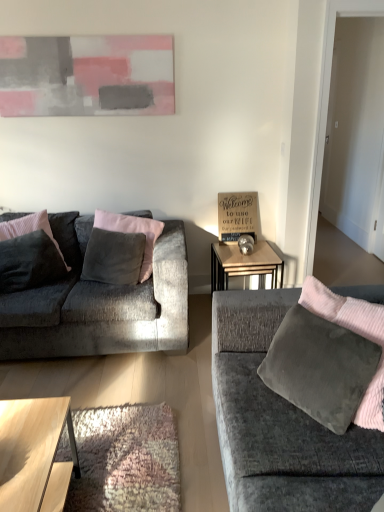
Question: Would you say abstract painting at upper center contains velvet dark gray pillow at left, the 1th pillow in the left-to-right sequence?

Choices:
 (A) no
 (B) yes

Answer: (A)

Question: From a real-world perspective, is abstract painting at upper center positioned over velvet dark gray pillow at left, the 1th pillow in the left-to-right sequence, based on gravity?

Choices:
 (A) yes
 (B) no

Answer: (A)

Question: Is abstract painting at upper center thinner than velvet dark gray pillow at left, the 1th pillow in the left-to-right sequence?

Choices:
 (A) no
 (B) yes

Answer: (B)

Question: From the image's perspective, is abstract painting at upper center beneath velvet dark gray pillow at left, which is counted as the second pillow, starting from the right?

Choices:
 (A) yes
 (B) no

Answer: (B)

Question: From the image's perspective, is abstract painting at upper center on velvet dark gray pillow at left, the 1th pillow in the left-to-right sequence?

Choices:
 (A) no
 (B) yes

Answer: (B)

Question: Considering the relative positions of abstract painting at upper center and velvet dark gray pillow at left, the 1th pillow in the left-to-right sequence, in the image provided, is abstract painting at upper center in front of velvet dark gray pillow at left, the 1th pillow in the left-to-right sequence,?

Choices:
 (A) yes
 (B) no

Answer: (B)

Question: Is abstract painting at upper center at the right side of velvet gray couch at right, marked as the 1th studio couch in a right-to-left arrangement?

Choices:
 (A) yes
 (B) no

Answer: (B)

Question: Is abstract painting at upper center positioned behind velvet gray couch at right, which is the 2th studio couch in left-to-right order?

Choices:
 (A) no
 (B) yes

Answer: (B)

Question: Is abstract painting at upper center positioned with its back to velvet gray couch at right, marked as the 1th studio couch in a right-to-left arrangement?

Choices:
 (A) no
 (B) yes

Answer: (A)

Question: Is abstract painting at upper center smaller than velvet gray couch at right, which is the 2th studio couch in left-to-right order?

Choices:
 (A) yes
 (B) no

Answer: (A)

Question: Is abstract painting at upper center next to velvet gray couch at right, which ranks as the second studio couch in back-to-front order?

Choices:
 (A) yes
 (B) no

Answer: (B)

Question: Can you confirm if abstract painting at upper center is shorter than velvet gray couch at right, marked as the 1th studio couch in a right-to-left arrangement?

Choices:
 (A) no
 (B) yes

Answer: (B)

Question: Does velvet gray pillow at center, the first pillow in the right-to-left sequence, lie behind light brown wooden coffee table at lower left?

Choices:
 (A) no
 (B) yes

Answer: (B)